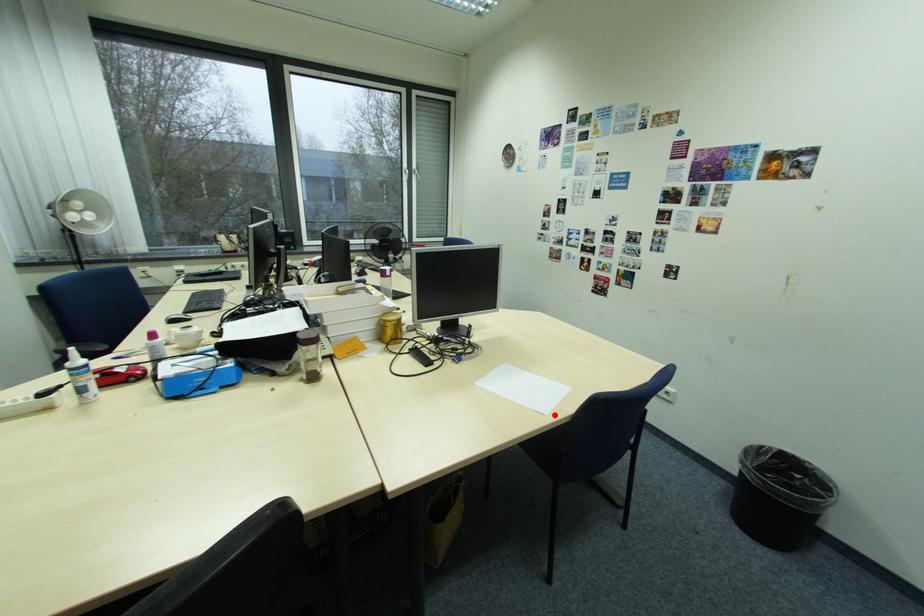
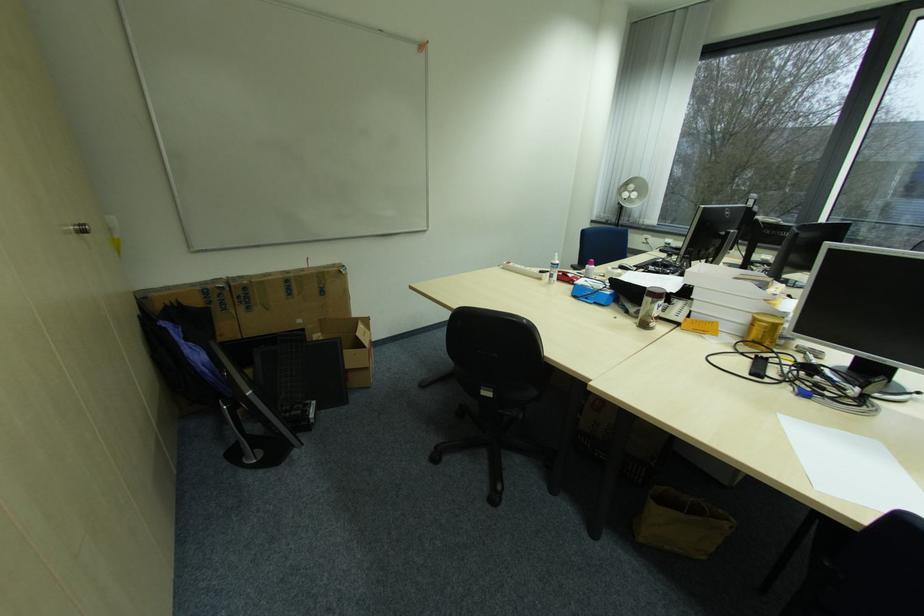
Where in the second image is the point corresponding to the highlighted location from the first image?

(824, 488)